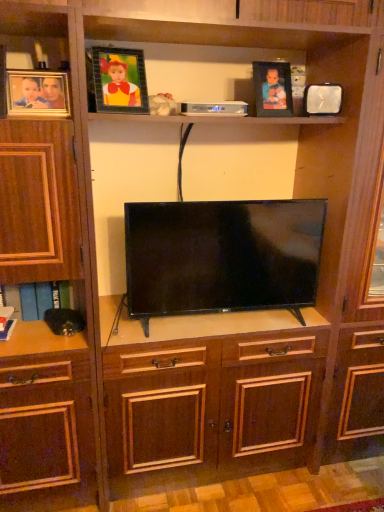
Question: Which direction should I rotate to face metallic frame at upper center, the third picture frame viewed from the right, — up or down?

Choices:
 (A) down
 (B) up

Answer: (B)

Question: Can you confirm if metallic frame at upper center, the third picture frame viewed from the right, is taller than matte wooden picture frame at upper left, which ranks as the first picture frame in left-to-right order?

Choices:
 (A) yes
 (B) no

Answer: (A)

Question: From a real-world perspective, is metallic frame at upper center, the second picture frame positioned from the left, located beneath matte wooden picture frame at upper left, which ranks as the first picture frame in left-to-right order?

Choices:
 (A) yes
 (B) no

Answer: (B)

Question: Is the depth of metallic frame at upper center, the third picture frame viewed from the right, greater than that of matte wooden picture frame at upper left, which ranks as the first picture frame in left-to-right order?

Choices:
 (A) no
 (B) yes

Answer: (B)

Question: Is metallic frame at upper center, the third picture frame viewed from the right, positioned before matte wooden picture frame at upper left, which appears as the 4th picture frame when viewed from the right?

Choices:
 (A) yes
 (B) no

Answer: (B)

Question: Is matte wooden picture frame at upper left, which appears as the 4th picture frame when viewed from the right, located within metallic frame at upper center, the second picture frame positioned from the left?

Choices:
 (A) yes
 (B) no

Answer: (B)

Question: Does metallic frame at upper center, the second picture frame positioned from the left, have a greater width compared to matte wooden picture frame at upper left, which ranks as the first picture frame in left-to-right order?

Choices:
 (A) yes
 (B) no

Answer: (A)

Question: Is metallic silver clock at upper right, which is counted as the fourth picture frame, starting from the left, outside matte black picture frame at upper center, the third picture frame positioned from the left?

Choices:
 (A) no
 (B) yes

Answer: (B)

Question: Considering the relative positions of metallic silver clock at upper right, which is counted as the fourth picture frame, starting from the left, and matte black picture frame at upper center, the third picture frame positioned from the left, in the image provided, is metallic silver clock at upper right, which is counted as the fourth picture frame, starting from the left, behind matte black picture frame at upper center, the third picture frame positioned from the left,?

Choices:
 (A) yes
 (B) no

Answer: (A)

Question: Could you tell me if metallic silver clock at upper right, which is counted as the fourth picture frame, starting from the left, is turned towards matte black picture frame at upper center, the second picture frame in the right-to-left sequence?

Choices:
 (A) yes
 (B) no

Answer: (B)

Question: Is metallic silver clock at upper right, which is counted as the fourth picture frame, starting from the left, closer to camera compared to matte black picture frame at upper center, the third picture frame positioned from the left?

Choices:
 (A) yes
 (B) no

Answer: (B)

Question: Would you say metallic silver clock at upper right, which is counted as the fourth picture frame, starting from the left, contains matte black picture frame at upper center, the third picture frame positioned from the left?

Choices:
 (A) no
 (B) yes

Answer: (A)

Question: Is metallic silver clock at upper right, the first picture frame positioned from the right, shorter than matte black picture frame at upper center, the third picture frame positioned from the left?

Choices:
 (A) yes
 (B) no

Answer: (A)

Question: Is flat screen tv at center next to matte wooden picture frame at upper left, which appears as the 4th picture frame when viewed from the right?

Choices:
 (A) no
 (B) yes

Answer: (A)